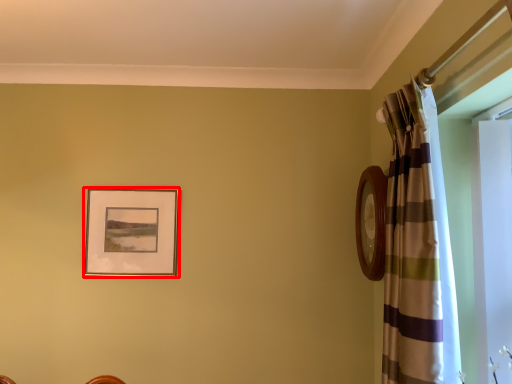
Question: From the image's perspective, what is the correct spatial positioning of picture frame (annotated by the red box) in reference to curtain?

Choices:
 (A) below
 (B) above

Answer: (A)